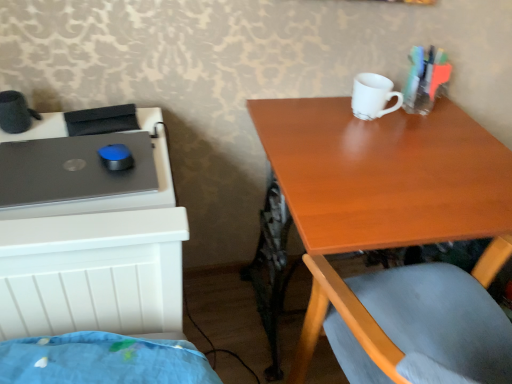
Identify the location of free region on the left part of white matte mug at upper center. The image size is (512, 384). (310, 115).